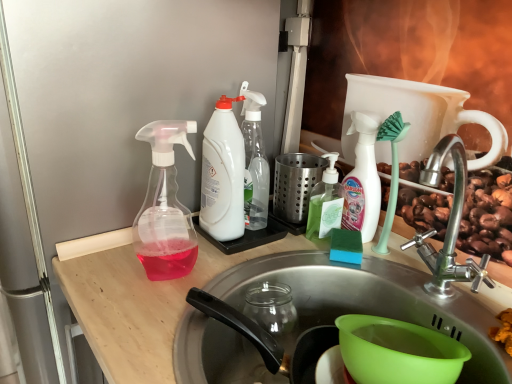
Where is `free space in front of green translucent soap dispenser at center, which is the fourth bottle in left-to-right order`? free space in front of green translucent soap dispenser at center, which is the fourth bottle in left-to-right order is located at coordinates (336, 269).